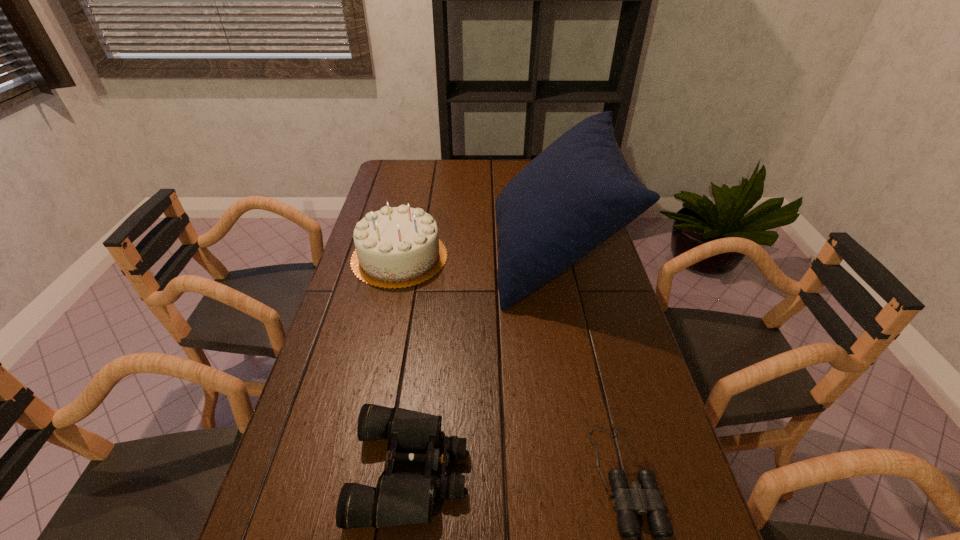
This screenshot has height=540, width=960. I want to click on the tallest object, so click(x=578, y=192).

You are a GUI agent. You are given a task and a screenshot of the screen. Output one action in this format:
    pyautogui.click(x=<x>, y=<y>)
    Task: Click on the birthday cake
    The image size is (960, 540).
    Given the screenshot: What is the action you would take?
    pyautogui.click(x=396, y=247)

Where is `the left binoculars`? This screenshot has height=540, width=960. the left binoculars is located at coordinates (x=400, y=498).

Identify the location of the taller binoculars. This screenshot has width=960, height=540. (400, 498).

You are a GUI agent. You are given a task and a screenshot of the screen. Output one action in this format:
    pyautogui.click(x=<x>, y=<y>)
    Task: Click on the vacant space located on the facing side of the tallest object
    
    Given the screenshot: What is the action you would take?
    pyautogui.click(x=433, y=255)

At what (x,y) coordinates should I click in order to perform the action: click on free region located 0.080m on the facing side of the tallest object. Please return your answer as a coordinate pair (x, y). This screenshot has width=960, height=540. Looking at the image, I should click on (470, 255).

At what (x,y) coordinates should I click in order to perform the action: click on free spot located on the facing side of the tallest object. Please return your answer as a coordinate pair (x, y). This screenshot has height=540, width=960. Looking at the image, I should click on (440, 255).

At what (x,y) coordinates should I click in order to perform the action: click on vacant position located 0.140m on the front of the birthday cake. Please return your answer as a coordinate pair (x, y). Image resolution: width=960 pixels, height=540 pixels. Looking at the image, I should click on (385, 324).

Where is `free space located through the eyepieces of the third tallest object`? The width and height of the screenshot is (960, 540). free space located through the eyepieces of the third tallest object is located at coordinates (501, 470).

Where is `birthday cake that is at the left edge`? The width and height of the screenshot is (960, 540). birthday cake that is at the left edge is located at coordinates (396, 247).